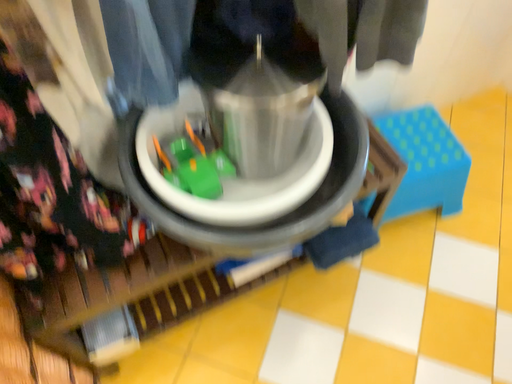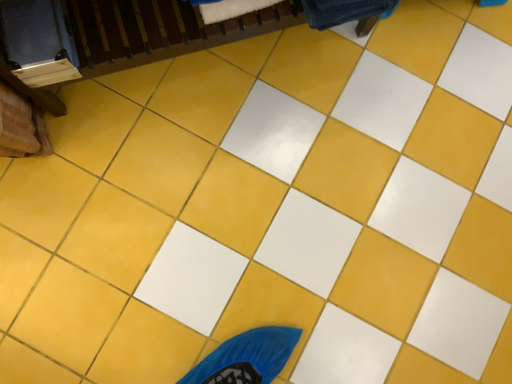
Question: Which way did the camera rotate in the video?

Choices:
 (A) rotated upward
 (B) rotated downward

Answer: (B)